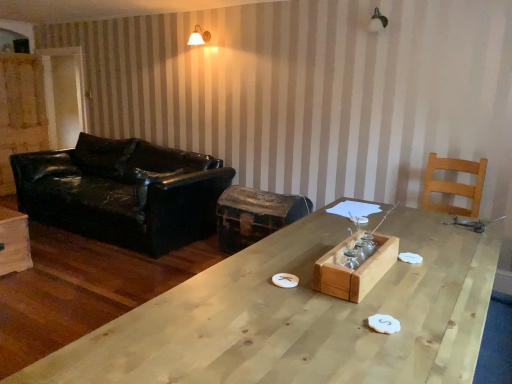
Question: Is natural wood table at center in front of or behind light brown wooden chair at right in the image?

Choices:
 (A) behind
 (B) front

Answer: (B)

Question: Is natural wood table at center wider or thinner than light brown wooden chair at right?

Choices:
 (A) thin
 (B) wide

Answer: (B)

Question: Which of these objects is positioned closest to the natural wood table at center?

Choices:
 (A) black leather couch at left
 (B) wooden tray at center
 (C) light brown wooden chair at right
 (D) white matte wall sconce at upper center
 (E) rusty metal trunk at center

Answer: (B)

Question: Estimate the real-world distances between objects in this image. Which object is farther from the black leather couch at left?

Choices:
 (A) light brown wooden chair at right
 (B) rusty metal trunk at center
 (C) white matte wall sconce at upper center
 (D) natural wood table at center
 (E) wooden tray at center

Answer: (E)